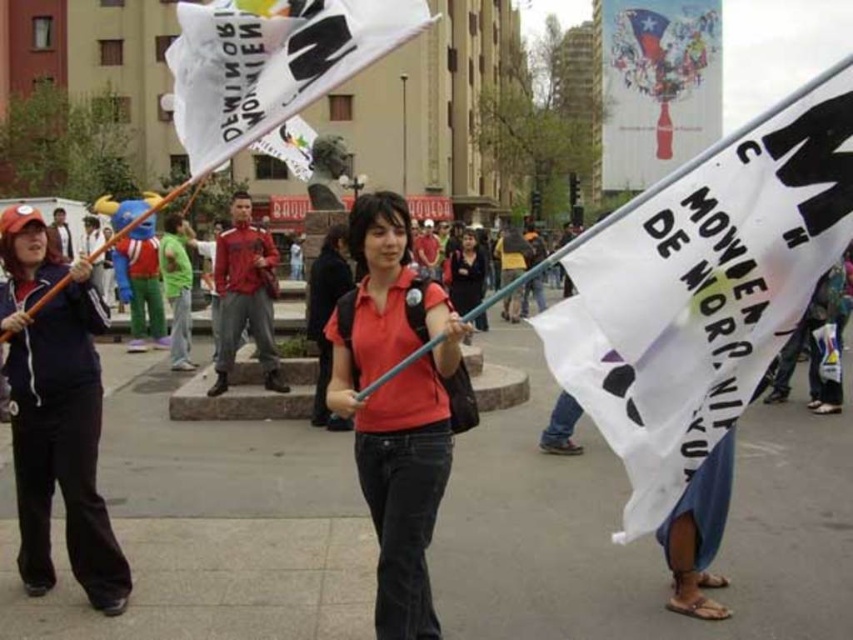
The width and height of the screenshot is (853, 640). What are the coordinates of `white paper flag at upper center` in the screenshot? It's located at (270, 64).

Is white paper flag at upper center to the right of matte black jacket at center from the viewer's perspective?

In fact, white paper flag at upper center is to the left of matte black jacket at center.

Is point (204, 154) behind point (457, 292)?

No, (204, 154) is in front of (457, 292).

Identify the location of white paper flag at upper center. The width and height of the screenshot is (853, 640). (270, 64).

Does matte red shirt at center have a larger size compared to matte black jacket at center?

No.

Where is `matte red shirt at center`? matte red shirt at center is located at coordinates (397, 404).

Which is in front, point (358, 205) or point (485, 273)?

Point (358, 205) is more forward.

This screenshot has height=640, width=853. What are the coordinates of `matte red shirt at center` in the screenshot? It's located at (397, 404).

Does matte red shirt at center have a lesser width compared to white paper flag at upper center?

Yes.

Who is more distant from viewer, [397,444] or [389,10]?

Point [397,444]

This screenshot has height=640, width=853. What are the coordinates of `matte red shirt at center` in the screenshot? It's located at tap(397, 404).